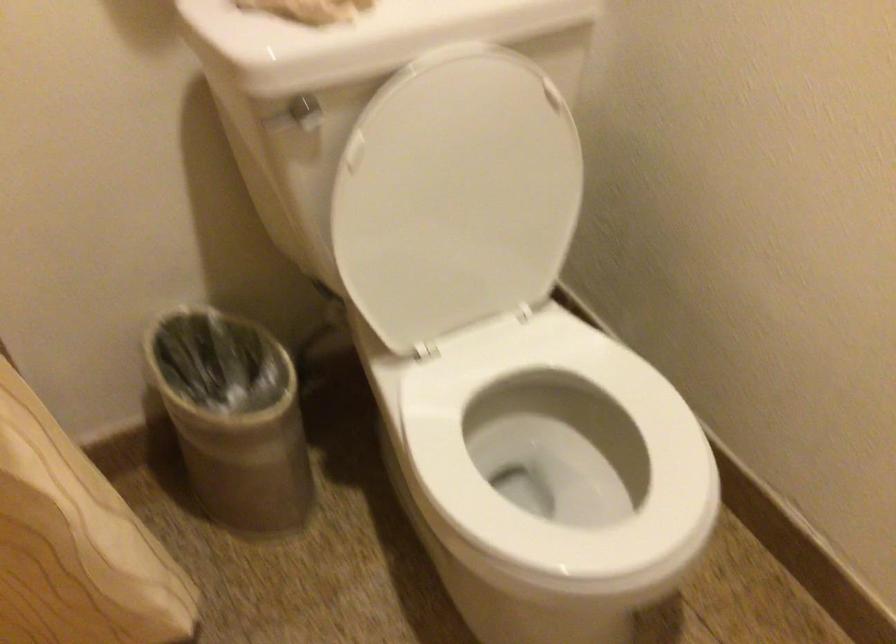
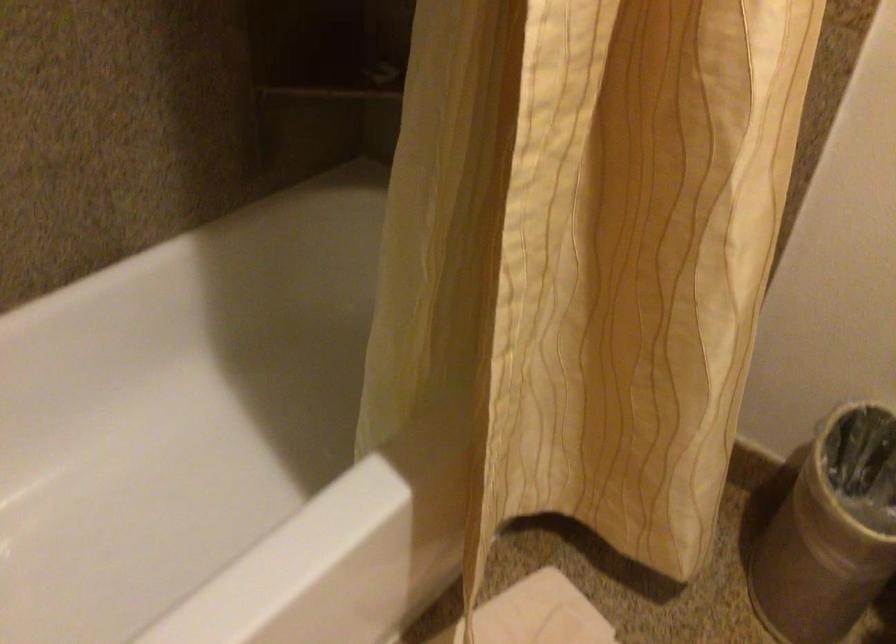
Question: The camera is either moving clockwise (left) or counter-clockwise (right) around the object. The first image is from the beginning of the video and the second image is from the end. Is the camera moving left or right when shooting the video?

Choices:
 (A) Left
 (B) Right

Answer: (B)